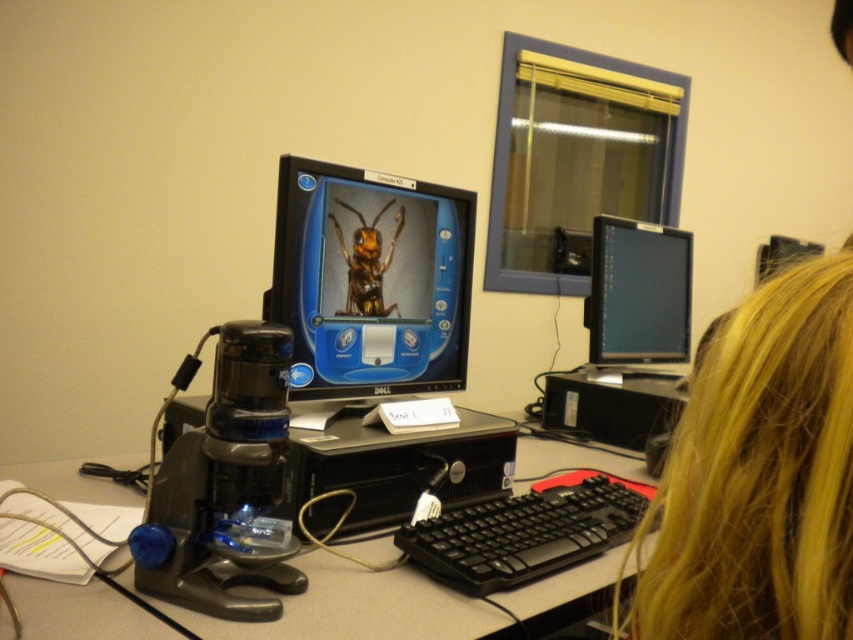
Question: Which object is closer to the camera taking this photo?

Choices:
 (A) metallic yellow insect at center
 (B) black plastic monitor at upper right
 (C) matte black monitor at upper right
 (D) matte black monitor at center

Answer: (D)

Question: Can you confirm if matte black monitor at center is positioned to the left of black plastic keyboard at lower center?

Choices:
 (A) yes
 (B) no

Answer: (A)

Question: Is blonde hair at upper right closer to the viewer compared to black plastic keyboard at lower center?

Choices:
 (A) yes
 (B) no

Answer: (A)

Question: Can you confirm if blonde hair at upper right is wider than matte black monitor at upper right?

Choices:
 (A) no
 (B) yes

Answer: (A)

Question: Which of the following is the farthest from the observer?

Choices:
 (A) (426, 378)
 (B) (70, 474)
 (C) (759, 364)
 (D) (636, 257)

Answer: (D)

Question: Which of the following is the farthest from the observer?

Choices:
 (A) black plastic computer desk at center
 (B) blonde hair at upper right

Answer: (A)